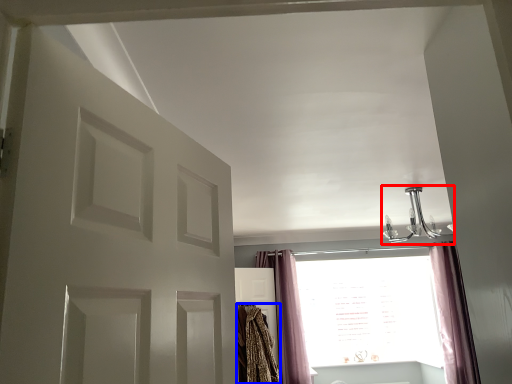
Question: Which of the following is the farthest to the observer, light fixture (highlighted by a red box) or blanket (highlighted by a blue box)?

Choices:
 (A) light fixture
 (B) blanket

Answer: (B)